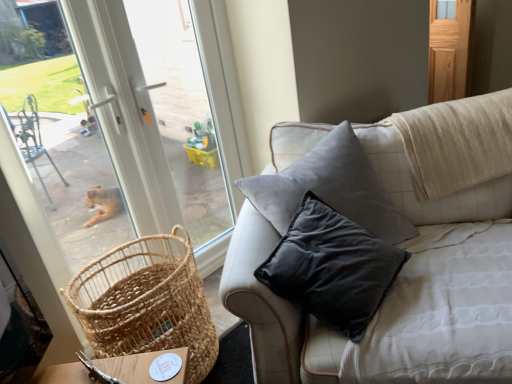
Question: From their relative heights in the image, would you say velvet grey pillow at upper right is taller or shorter than wooden screen door at upper right?

Choices:
 (A) tall
 (B) short

Answer: (A)

Question: Considering the positions of velvet grey pillow at upper right and wooden screen door at upper right in the image, is velvet grey pillow at upper right wider or thinner than wooden screen door at upper right?

Choices:
 (A) wide
 (B) thin

Answer: (A)

Question: Which object is the closest to the wooden screen door at upper right?

Choices:
 (A) velvet grey pillow at upper right
 (B) woven natural basket at lower left

Answer: (A)

Question: Which of these objects is positioned farthest from the velvet grey pillow at upper right?

Choices:
 (A) wooden screen door at upper right
 (B) woven natural basket at lower left

Answer: (A)